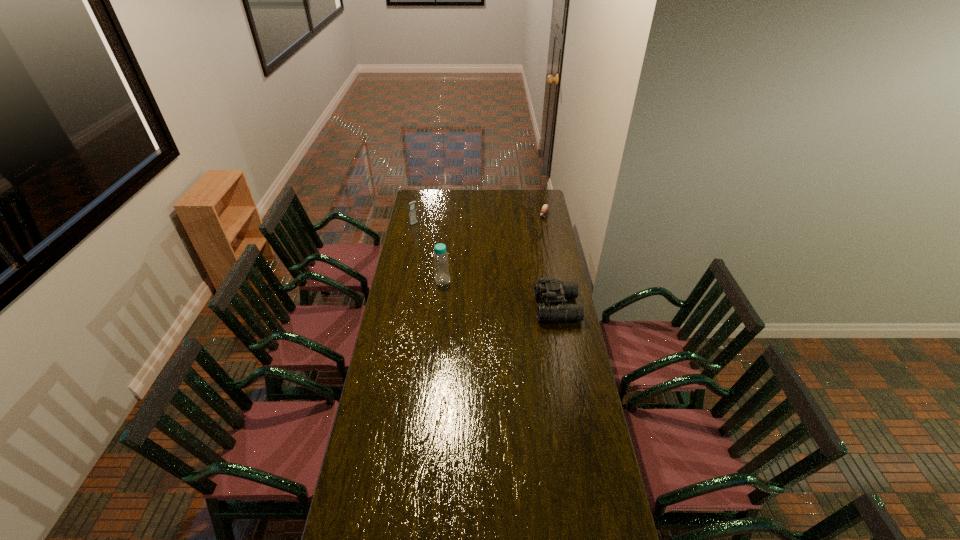
This screenshot has width=960, height=540. What are the coordinates of `vacant point located between the farthest object and the third farthest object` in the screenshot? It's located at (493, 248).

The image size is (960, 540). In order to click on free area in between the second object from left to right and the shortest object in this screenshot , I will do `click(493, 248)`.

I want to click on free space between the second farthest object and the nearest object, so click(486, 266).

Locate an element on the screen. The height and width of the screenshot is (540, 960). unoccupied position between the nearest object and the shortest object is located at coordinates (550, 261).

Identify the location of free spot between the binoculars and the shortest object. (550, 261).

Select which object appears as the third closest to the shortest object. Please provide its 2D coordinates. Your answer should be formatted as a tuple, i.e. [(x, y)], where the tuple contains the x and y coordinates of a point satisfying the conditions above.

[(412, 212)]

Where is `the third closest object to the second object from left to right`? the third closest object to the second object from left to right is located at coordinates (545, 207).

Find the location of a particular element. The image size is (960, 540). vacant area in the image that satisfies the following two spatial constraints: 1. on the front side of the binoculars; 2. through the lenses of the cellular telephone is located at coordinates (397, 307).

Locate an element on the screen. This screenshot has height=540, width=960. free space that satisfies the following two spatial constraints: 1. on the front side of the binoculars; 2. through the lenses of the second farthest object is located at coordinates (397, 307).

Locate an element on the screen. free location that satisfies the following two spatial constraints: 1. on the back side of the escargot; 2. on the right side of the cellular telephone is located at coordinates click(x=416, y=215).